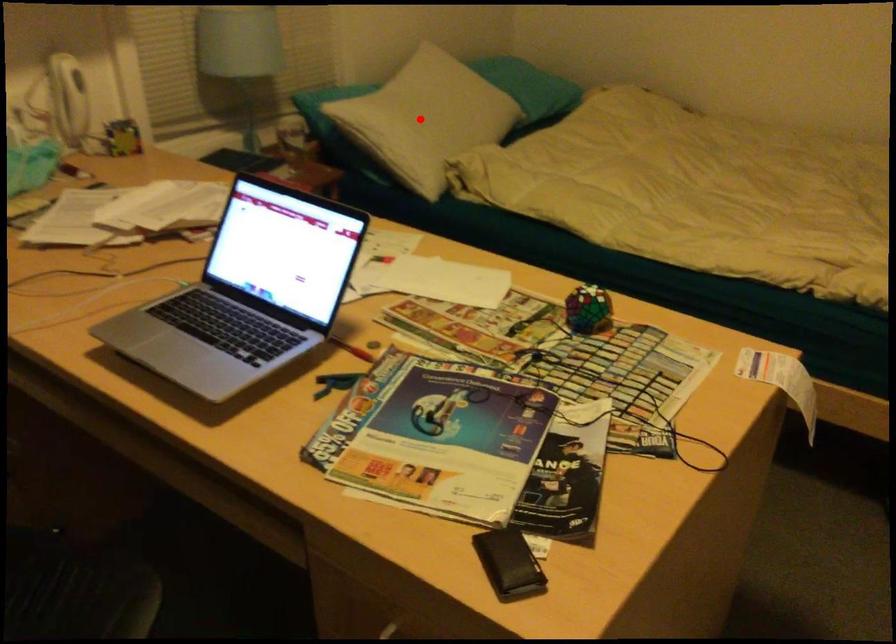
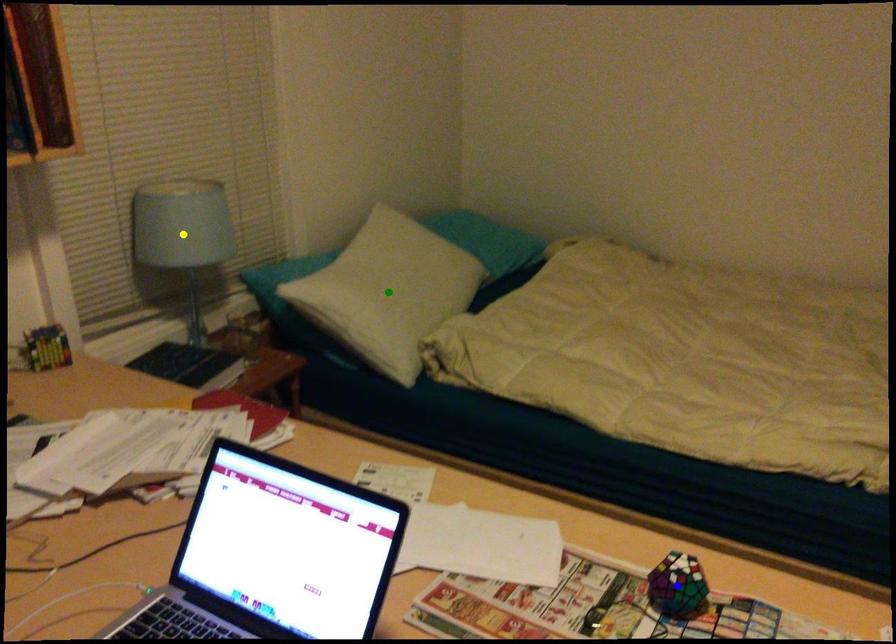
Question: I am providing you with two images of the same scene from different viewpoints. A red point is marked on the first image. You are given multiple points on the second image. Which spot in image 2 lines up with the point in image 1?

Choices:
 (A) green point
 (B) yellow point
 (C) blue point

Answer: (A)